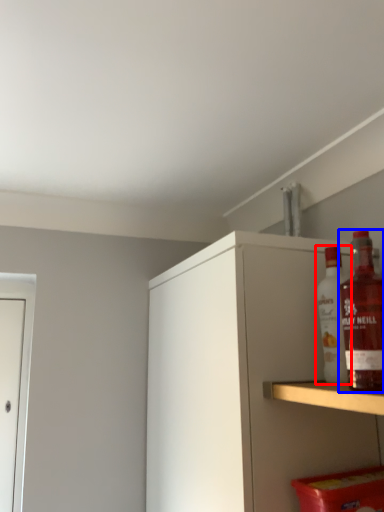
Question: Among these objects, which one is nearest to the camera, bottle (highlighted by a red box) or bottle (highlighted by a blue box)?

Choices:
 (A) bottle
 (B) bottle

Answer: (B)